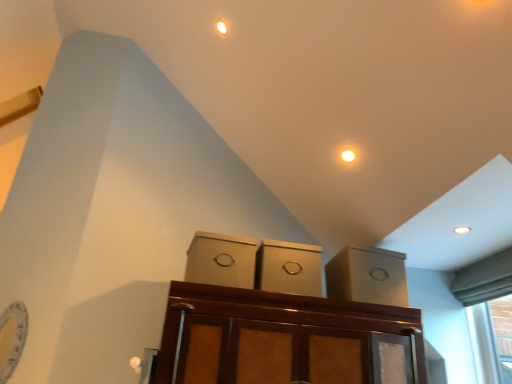
Question: Is matte cardboard box at center, acting as the third cabinetry starting from the left, smaller than matte cardboard box at center, the 3th cabinetry viewed from the right?

Choices:
 (A) no
 (B) yes

Answer: (A)

Question: Is matte cardboard box at center, which is counted as the first cabinetry, starting from the right, to the left of matte cardboard box at center, acting as the first cabinetry starting from the left, from the viewer's perspective?

Choices:
 (A) no
 (B) yes

Answer: (A)

Question: Does matte cardboard box at center, acting as the third cabinetry starting from the left, have a lesser width compared to matte cardboard box at center, acting as the first cabinetry starting from the left?

Choices:
 (A) yes
 (B) no

Answer: (B)

Question: Would you consider matte cardboard box at center, which is counted as the first cabinetry, starting from the right, to be distant from matte cardboard box at center, the 3th cabinetry viewed from the right?

Choices:
 (A) yes
 (B) no

Answer: (B)

Question: Is matte cardboard box at center, which is counted as the first cabinetry, starting from the right, positioned beyond the bounds of matte cardboard box at center, acting as the first cabinetry starting from the left?

Choices:
 (A) no
 (B) yes

Answer: (B)

Question: From a real-world perspective, is matte cardboard box at center, which is counted as the first cabinetry, starting from the right, located higher than matte cardboard box at center, acting as the first cabinetry starting from the left?

Choices:
 (A) no
 (B) yes

Answer: (B)

Question: Is matte cardboard boxes at center, arranged as the 2th cabinetry when viewed from the left, touching matte cardboard box at center, the 3th cabinetry viewed from the right?

Choices:
 (A) no
 (B) yes

Answer: (A)

Question: Does matte cardboard boxes at center, arranged as the 2th cabinetry when viewed from the left, have a greater height compared to matte cardboard box at center, acting as the first cabinetry starting from the left?

Choices:
 (A) no
 (B) yes

Answer: (B)

Question: Is matte cardboard boxes at center, the second cabinetry in the right-to-left sequence, behind matte cardboard box at center, acting as the first cabinetry starting from the left?

Choices:
 (A) no
 (B) yes

Answer: (B)

Question: Does matte cardboard boxes at center, arranged as the 2th cabinetry when viewed from the left, appear on the left side of matte cardboard box at center, acting as the first cabinetry starting from the left?

Choices:
 (A) no
 (B) yes

Answer: (A)

Question: Is the position of matte cardboard boxes at center, the second cabinetry in the right-to-left sequence, less distant than that of matte cardboard box at center, acting as the first cabinetry starting from the left?

Choices:
 (A) no
 (B) yes

Answer: (A)

Question: Is matte cardboard boxes at center, arranged as the 2th cabinetry when viewed from the left, outside of matte cardboard box at center, acting as the first cabinetry starting from the left?

Choices:
 (A) no
 (B) yes

Answer: (B)

Question: Does matte cardboard box at center, the 3th cabinetry viewed from the right, have a smaller size compared to matte cardboard box at center, acting as the third cabinetry starting from the left?

Choices:
 (A) no
 (B) yes

Answer: (B)